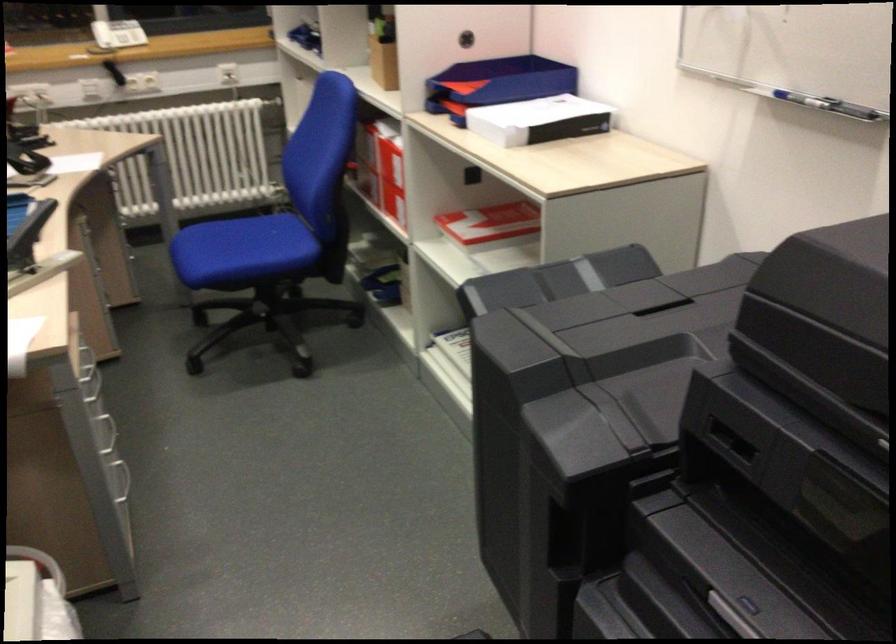
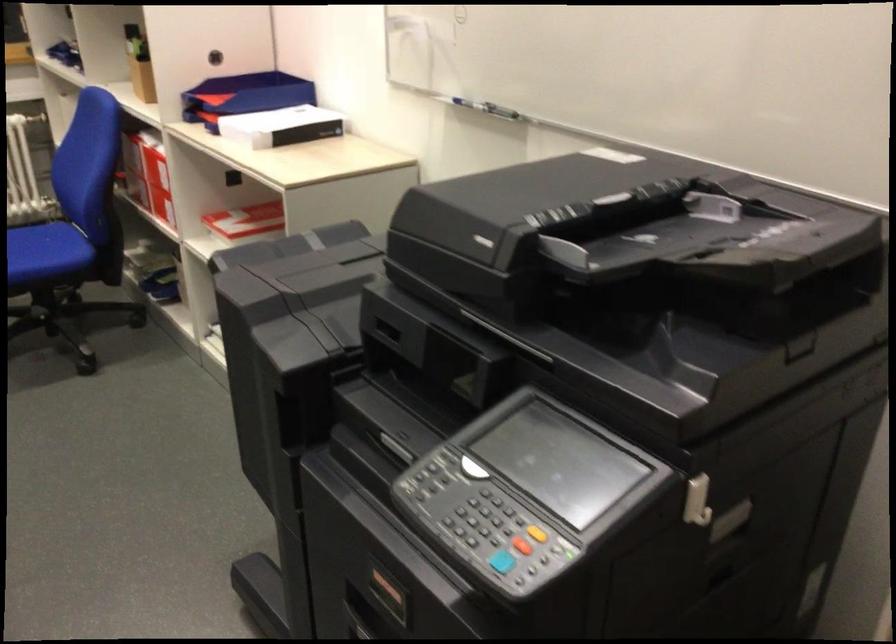
Find the pixel in the second image that matches point (512, 196) in the first image.

(271, 198)